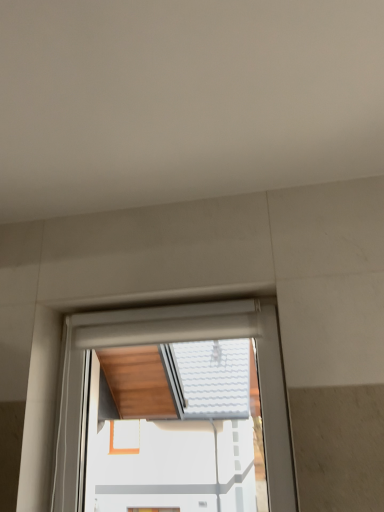
Question: Should I look upward or downward to see white matte window at center?

Choices:
 (A) down
 (B) up

Answer: (A)